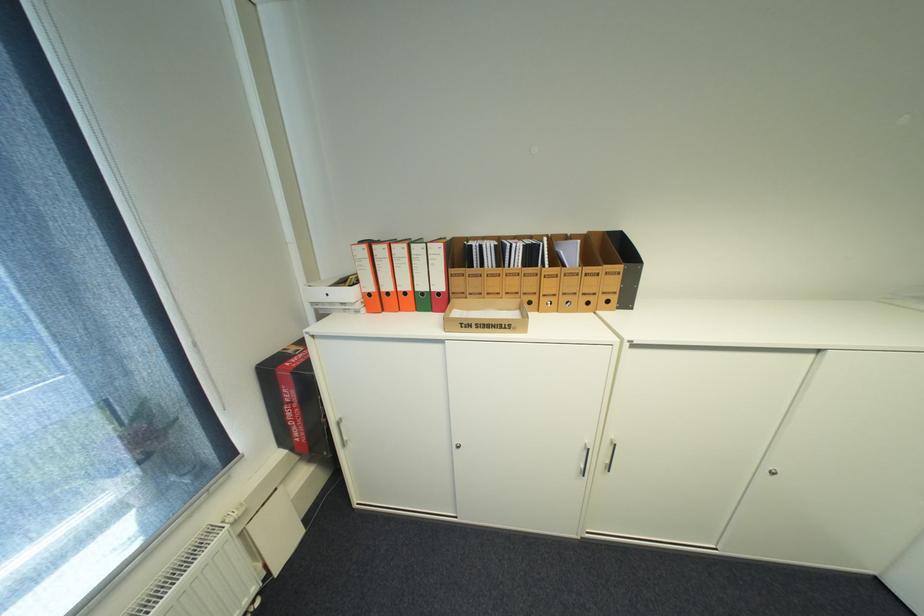
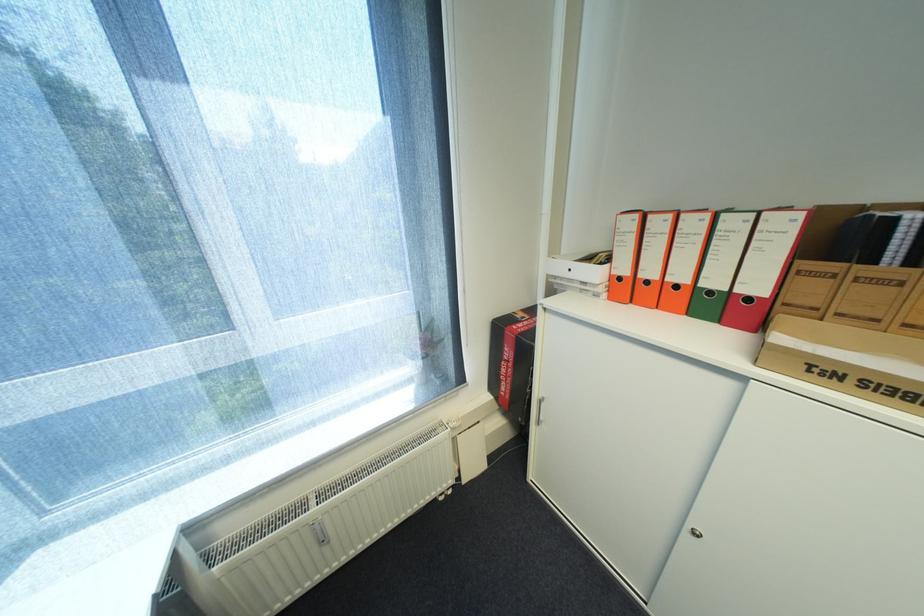
Question: I am providing you with two images of the same scene from different viewpoints. Please identify which objects are invisible in image2.

Choices:
 (A) radiator thermostat knob
 (B) cabinet door handle
 (C) red and black box
 (D) none of these

Answer: (D)